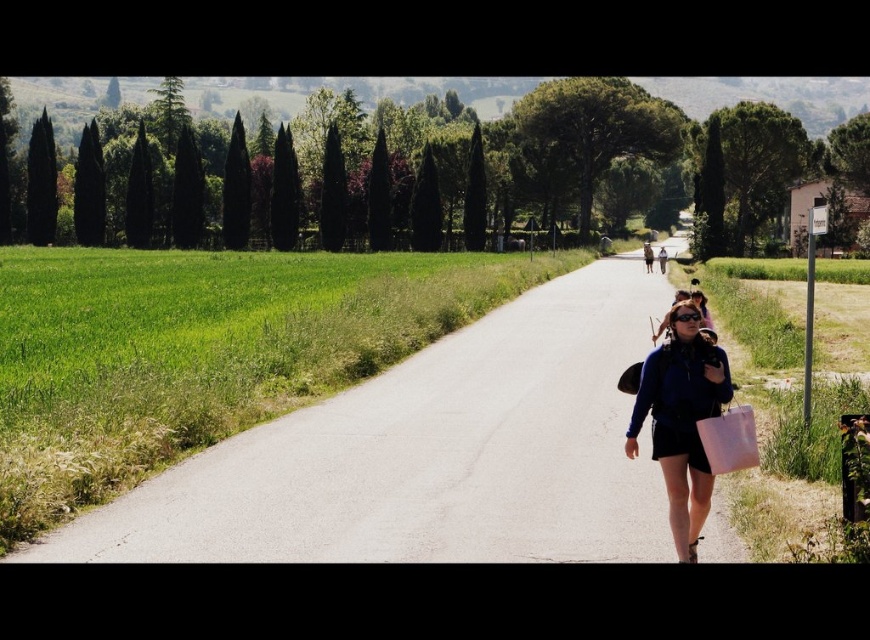
You are standing at the point with coordinates point [707,461] and want to walk to the point with coordinates point [159,497]. According to the scene, will you be moving towards the road or away from it?

The point [159,497] is behind point [707,461], so moving from point [707,461] to point [159,497] means you are moving away from the road.

You are a photographer standing at the edge of the road. You want to take a photo of the matte blue jacket at center and the white fabric bag at lower right so that both are clearly visible in the frame. Given their distance apart, is it possible to capture both in a single shot without moving your position?

The matte blue jacket at center and white fabric bag at lower right are 24.85 centimeters apart from each other. Since the distance between them is relatively small, it should be possible to capture both in a single photo without moving your position, provided the camera lens has an appropriate focal length to accommodate the 24.85 cm separation.

You are standing at the edge of the smooth asphalt road at center and want to pick up the white fabric bag at lower right. In which direction should you move to reach it?

The white fabric bag at lower right is to the left of the smooth asphalt road at center, so you should move to your left to reach it.